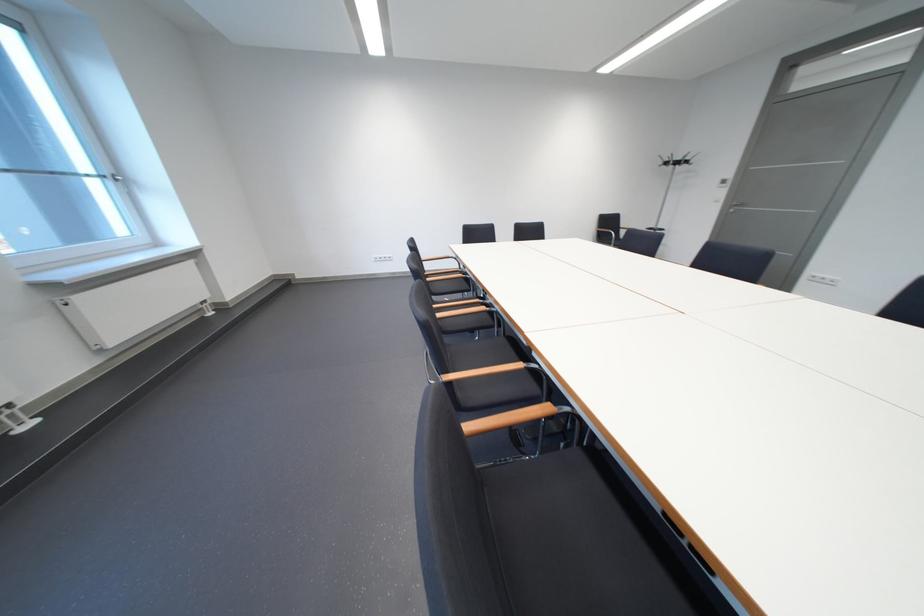
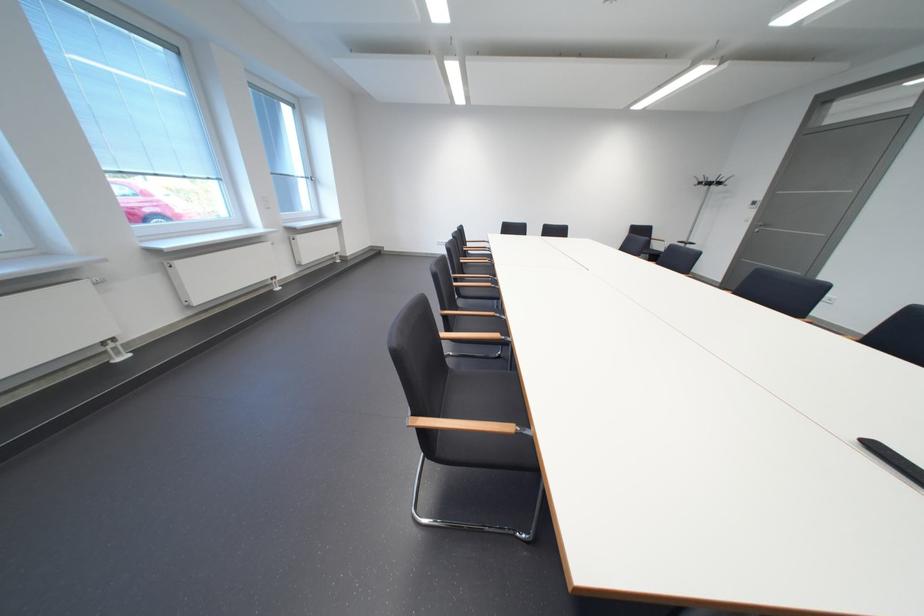
Where in the second image is the point corresponding to the point at 690,164 from the first image?

(723, 185)